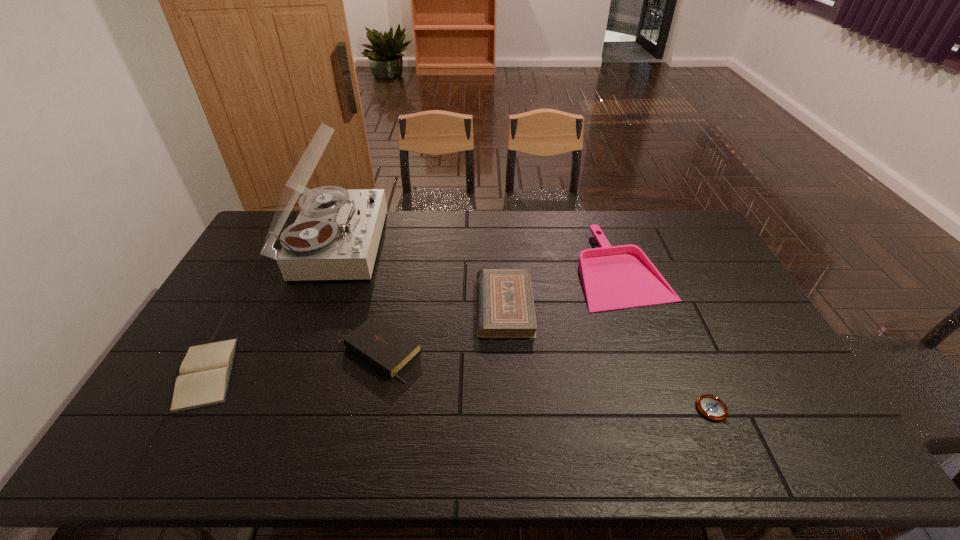
At what (x,y) coordinates should I click in order to perform the action: click on blank region between the dustpan and the leftmost Bible. Please return your answer as a coordinate pair (x, y). Looking at the image, I should click on [415, 321].

Where is `free space between the dustpan and the third object from right to left`? free space between the dustpan and the third object from right to left is located at coordinates (564, 287).

Identify the location of empty space that is in between the shortest Bible and the second Bible from left to right. (295, 362).

Locate an element on the screen. The height and width of the screenshot is (540, 960). blank region between the second Bible from left to right and the third object from right to left is located at coordinates (444, 329).

Find the location of a particular element. Image resolution: width=960 pixels, height=540 pixels. object that is the fifth closest to the shortest Bible is located at coordinates (710, 406).

I want to click on object that ranks as the second closest to the compass, so click(x=505, y=307).

Where is `the closest Bible to the dustpan`? the closest Bible to the dustpan is located at coordinates (505, 307).

This screenshot has width=960, height=540. Find the location of `Bible identified as the closest to the dustpan`. Bible identified as the closest to the dustpan is located at coordinates (505, 307).

Identify the location of vacant space that satisfies the following two spatial constraints: 1. on the handle side of the dustpan; 2. on the left side of the shortest object. This screenshot has width=960, height=540. (674, 410).

In order to click on vacant space that satisfies the following two spatial constraints: 1. on the back side of the second Bible from right to left; 2. on the left side of the leftmost Bible in this screenshot , I will do `click(219, 352)`.